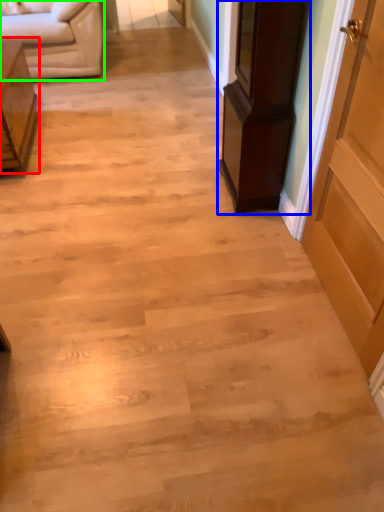
Question: Which object is positioned farthest from furniture (highlighted by a red box)? Select from furniture (highlighted by a blue box) and studio couch (highlighted by a green box).

Choices:
 (A) furniture
 (B) studio couch

Answer: (A)